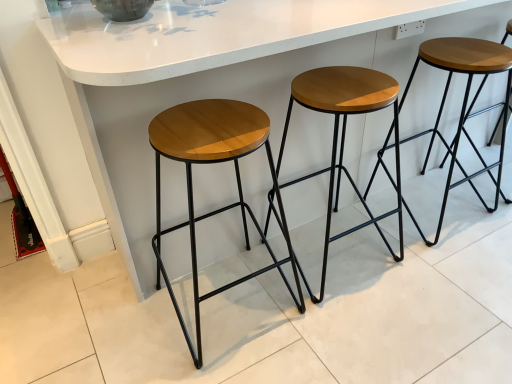
The width and height of the screenshot is (512, 384). Identify the location of free space between wooden/matte stool at center, the third stool from the right, and wooden/matte stool at center, marked as the 2th stool in a left-to-right arrangement. (291, 277).